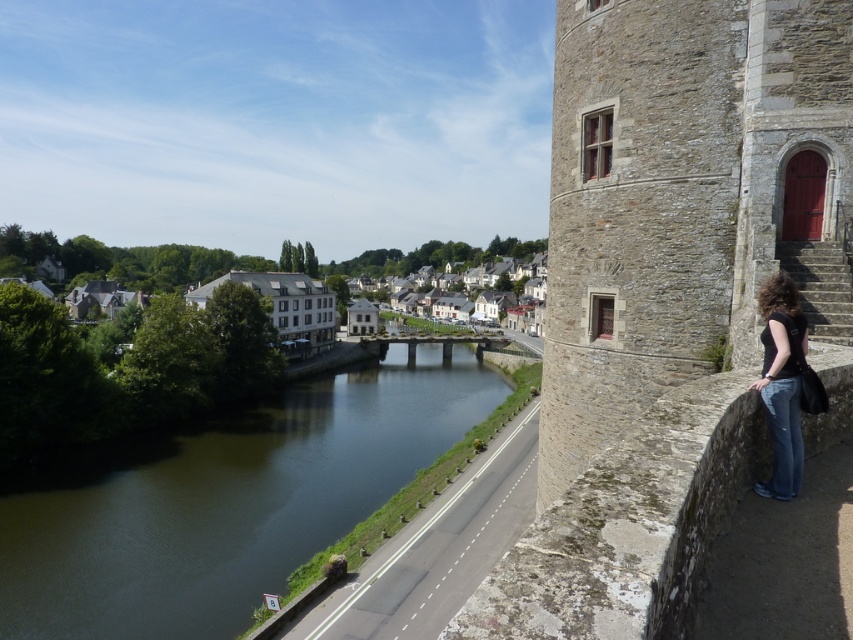
Does stone tower at right lie behind white stone buildings at center?

That is False.

Who is more distant from viewer, (833,333) or (212,272)?

Positioned behind is point (212,272).

The image size is (853, 640). What are the coordinates of `stone tower at right` in the screenshot? It's located at (679, 193).

Can you confirm if stone tower at right is thinner than white stone houses at center?

Yes, stone tower at right is thinner than white stone houses at center.

Is stone tower at right shorter than white stone houses at center?

Indeed, stone tower at right has a lesser height compared to white stone houses at center.

Does point (611, 179) lie in front of point (407, 257)?

Yes, point (611, 179) is closer to viewer.

In order to click on stone tower at right in this screenshot , I will do `click(679, 193)`.

Which of these two, white stone buildings at center or white stone houses at center, stands taller?

white stone buildings at center

Is white stone buildings at center to the right of white stone houses at center from the viewer's perspective?

No, white stone buildings at center is not to the right of white stone houses at center.

Find the location of a particular element. white stone buildings at center is located at coordinates (119, 262).